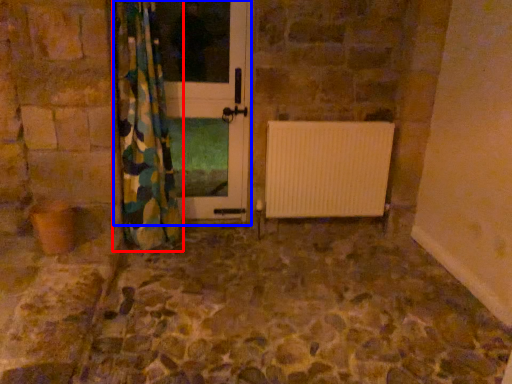
Question: Which point is closer to the camera, curtain (highlighted by a red box) or screen door (highlighted by a blue box)?

Choices:
 (A) curtain
 (B) screen door

Answer: (A)